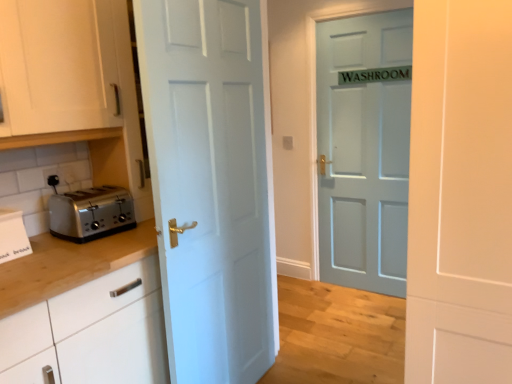
I want to click on free space in front of satin silver toaster at left, so click(90, 246).